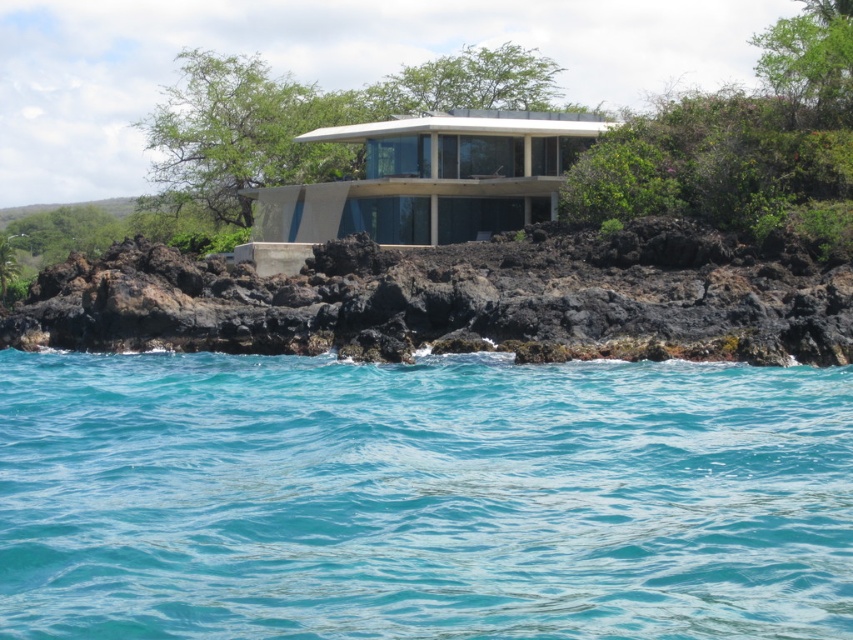
Question: Among these objects, which one is farthest from the camera?

Choices:
 (A) black volcanic rock at center
 (B) clear blue water at center

Answer: (A)

Question: Is clear blue water at center to the right of black volcanic rock at center from the viewer's perspective?

Choices:
 (A) yes
 (B) no

Answer: (A)

Question: Which point is closer to the camera taking this photo?

Choices:
 (A) (578, 531)
 (B) (689, 266)

Answer: (A)

Question: Can you confirm if clear blue water at center is wider than black volcanic rock at center?

Choices:
 (A) no
 (B) yes

Answer: (A)

Question: Can you confirm if clear blue water at center is positioned below black volcanic rock at center?

Choices:
 (A) yes
 (B) no

Answer: (A)